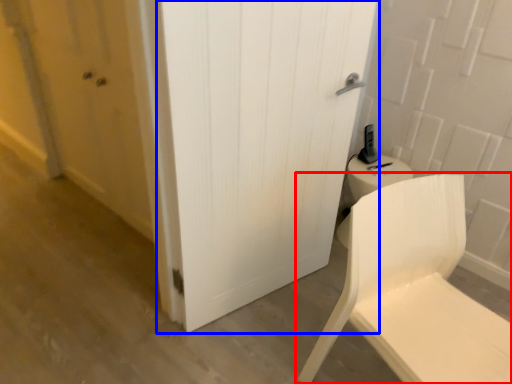
Question: Among these objects, which one is farthest to the camera, chair (highlighted by a red box) or door (highlighted by a blue box)?

Choices:
 (A) chair
 (B) door

Answer: (B)